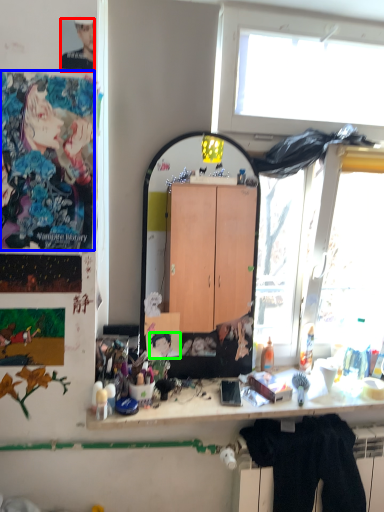
Question: Which object is the farthest from person (highlighted by a red box)? Choose among these: person (highlighted by a blue box) or person (highlighted by a green box).

Choices:
 (A) person
 (B) person

Answer: (B)